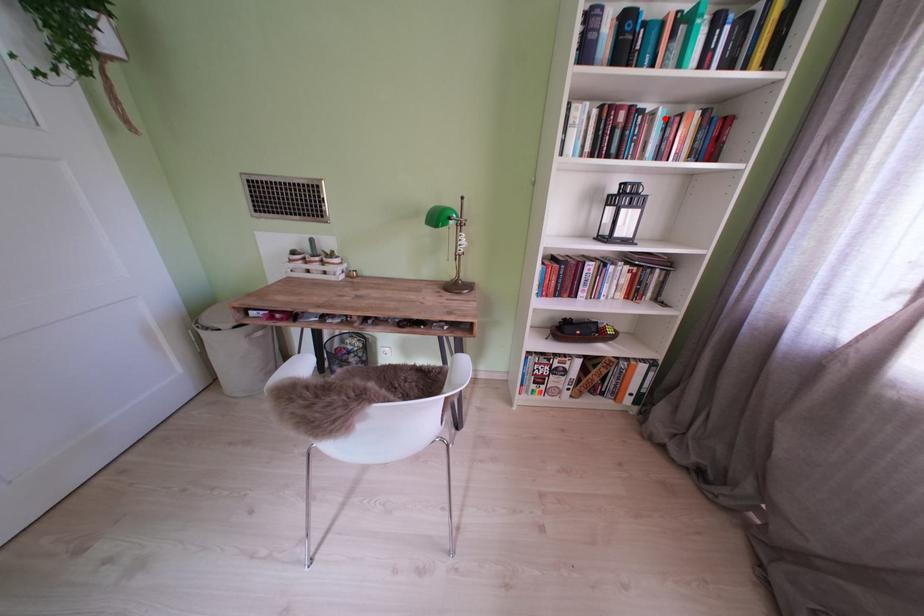
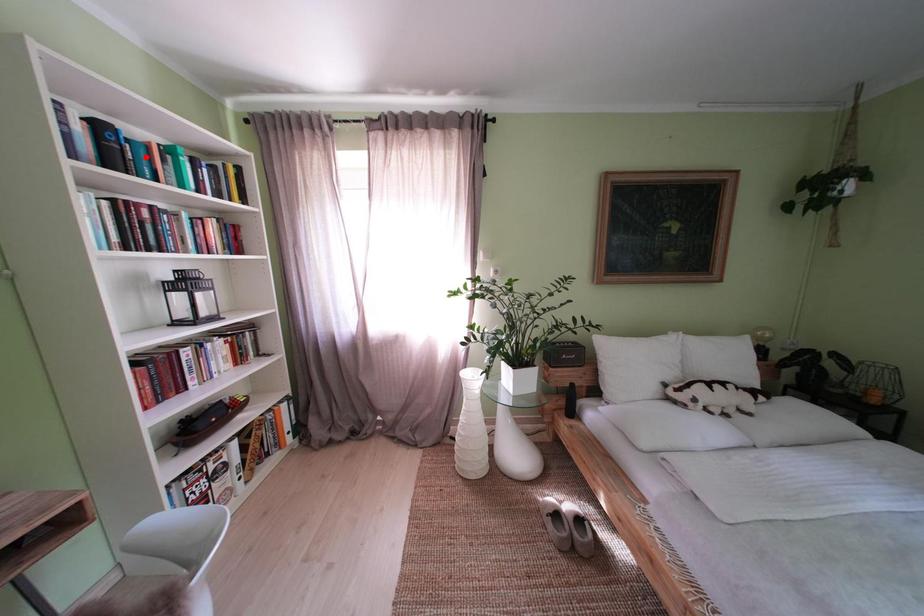
I am providing you with two images of the same scene from different viewpoints. A red point is marked on the first image and another point is marked on the second image. Do the highlighted points in image1 and image2 indicate the same real-world spot?

No